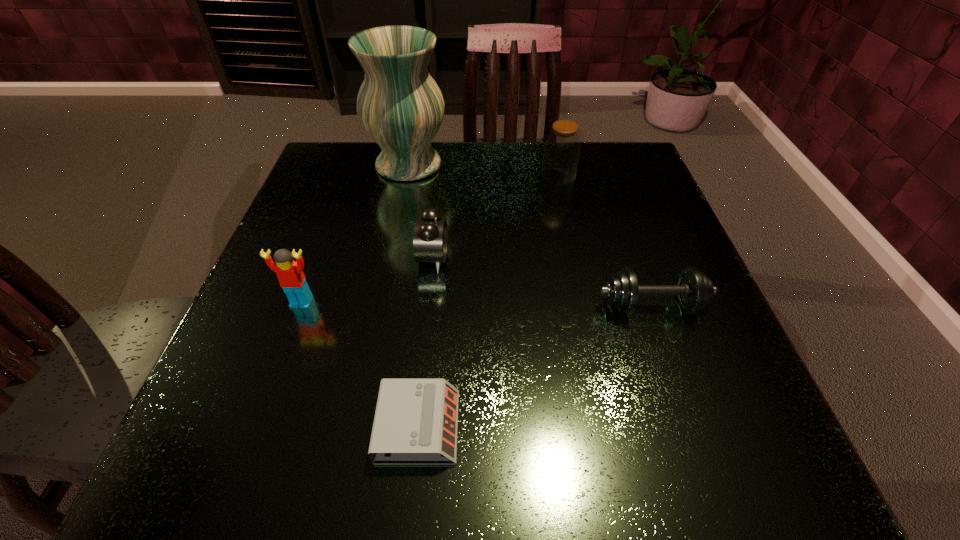
Where is `vase`? Image resolution: width=960 pixels, height=540 pixels. vase is located at coordinates (401, 107).

At what (x,y) coordinates should I click in order to perform the action: click on jar. Please return your answer as a coordinate pair (x, y). This screenshot has width=960, height=540. Looking at the image, I should click on (562, 146).

Image resolution: width=960 pixels, height=540 pixels. What are the coordinates of `the leftmost object` in the screenshot? It's located at (290, 274).

Locate an element on the screen. the fourth tallest object is located at coordinates coord(430,236).

Locate an element on the screen. This screenshot has width=960, height=540. the fourth nearest object is located at coordinates (430, 236).

Where is `dumbbell`? dumbbell is located at coordinates (694, 290).

The height and width of the screenshot is (540, 960). What are the coordinates of `the nearest object` in the screenshot? It's located at (416, 420).

Find the location of `the shortest object`. the shortest object is located at coordinates (416, 420).

The image size is (960, 540). Identify the location of vacant space situated on the front of the tallest object. (393, 240).

Where is `free space located 0.220m on the front of the jar`? The image size is (960, 540). free space located 0.220m on the front of the jar is located at coordinates (575, 252).